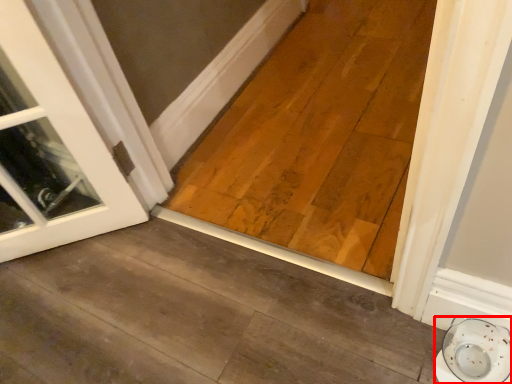
Question: From the image's perspective, where is saucer (annotated by the red box) located relative to plank?

Choices:
 (A) below
 (B) above

Answer: (A)